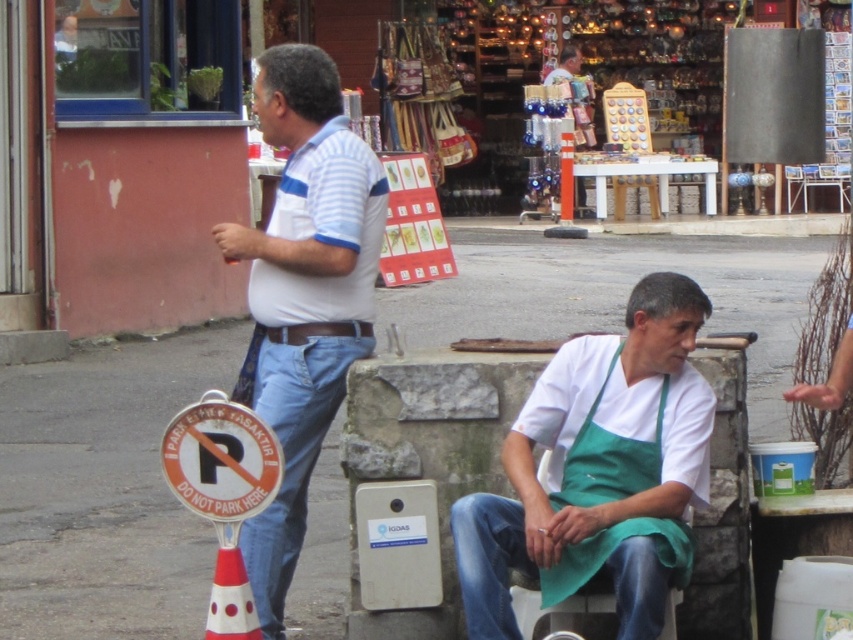
Question: Among these points, which one is nearest to the camera?

Choices:
 (A) (206, 632)
 (B) (260, 288)
 (C) (651, 461)
 (D) (0, 502)

Answer: (C)

Question: Can you confirm if white cotton shirt at center is positioned below blue denim jeans at left?

Choices:
 (A) yes
 (B) no

Answer: (B)

Question: Observing the image, what is the correct spatial positioning of gray concrete pavement at center in reference to jeans at lower center?

Choices:
 (A) below
 (B) above

Answer: (B)

Question: Which point is closer to the camera taking this photo?

Choices:
 (A) (514, 516)
 (B) (276, 589)
 (C) (509, 436)

Answer: (A)

Question: Does white cotton shirt at center appear over white plastic sign at lower left?

Choices:
 (A) yes
 (B) no

Answer: (B)

Question: Estimate the real-world distances between objects in this image. Which object is closer to the jeans at lower center?

Choices:
 (A) blue denim jeans at left
 (B) white plastic sign at lower left
 (C) white plastic traffic cone at lower left
 (D) white cotton shirt at center

Answer: (D)